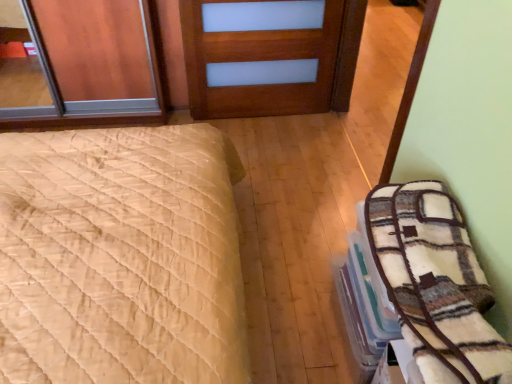
The image size is (512, 384). Describe the element at coordinates (260, 56) in the screenshot. I see `wooden door at center` at that location.

Describe the element at coordinates (435, 283) in the screenshot. Image resolution: width=512 pixels, height=384 pixels. I see `plush white blanket at right` at that location.

Locate an element on the screen. beige quilted bed at left is located at coordinates (121, 257).

From a real-world perspective, is plush white blanket at right physically located above or below beige quilted bed at left?

Clearly, from a real-world perspective, plush white blanket at right is above beige quilted bed at left.

Which of these two, plush white blanket at right or beige quilted bed at left, is bigger?

With larger size is beige quilted bed at left.

What's the angular difference between plush white blanket at right and beige quilted bed at left's facing directions?

The angular difference between plush white blanket at right and beige quilted bed at left is 180 degrees.

Consider the image. From the image's perspective, is plush white blanket at right beneath beige quilted bed at left?

Correct, plush white blanket at right appears lower than beige quilted bed at left in the image.

Is beige quilted bed at left bigger than wooden door at center?

Yes.

Which is more to the left, beige quilted bed at left or wooden door at center?

From the viewer's perspective, beige quilted bed at left appears more on the left side.

How much distance is there between beige quilted bed at left and wooden door at center?

beige quilted bed at left and wooden door at center are 3.84 feet apart.

Can you confirm if beige quilted bed at left is thinner than wooden door at center?

No.

Is plush white blanket at right facing away from wooden door at center?

No, plush white blanket at right is not facing the opposite direction of wooden door at center.

Looking at this image, from the image's perspective, is plush white blanket at right located beneath wooden door at center?

Correct, plush white blanket at right appears lower than wooden door at center in the image.

Is plush white blanket at right bigger or smaller than wooden door at center?

Clearly, plush white blanket at right is smaller in size than wooden door at center.

Considering the positions of objects plush white blanket at right and wooden door at center in the image provided, who is more to the right, plush white blanket at right or wooden door at center?

plush white blanket at right is more to the right.

Considering the sizes of objects wooden door at center and plush white blanket at right in the image provided, who is bigger, wooden door at center or plush white blanket at right?

Bigger between the two is wooden door at center.

Is wooden door at center wider or thinner than plush white blanket at right?

In the image, wooden door at center appears to be more narrow than plush white blanket at right.

Would you say wooden door at center is inside or outside plush white blanket at right?

The correct answer is: outside.

Is beige quilted bed at left spatially inside plush white blanket at right, or outside of it?

beige quilted bed at left is not inside plush white blanket at right, it's outside.

Considering the relative positions of beige quilted bed at left and plush white blanket at right in the image provided, is beige quilted bed at left to the right of plush white blanket at right from the viewer's perspective?

Incorrect, beige quilted bed at left is not on the right side of plush white blanket at right.

Considering the sizes of objects beige quilted bed at left and plush white blanket at right in the image provided, who is shorter, beige quilted bed at left or plush white blanket at right?

Standing shorter between the two is plush white blanket at right.

Is point (51, 356) in front of point (436, 193)?

Yes, it is in front of point (436, 193).

Is wooden door at center situated inside beige quilted bed at left or outside?

wooden door at center is not enclosed by beige quilted bed at left.

Which object is further away from the camera taking this photo, wooden door at center or beige quilted bed at left?

Positioned behind is wooden door at center.

Is wooden door at center oriented towards beige quilted bed at left?

No, wooden door at center is not oriented towards beige quilted bed at left.

How many degrees apart are the facing directions of wooden door at center and beige quilted bed at left?

71.2 degrees separate the facing orientations of wooden door at center and beige quilted bed at left.

Image resolution: width=512 pixels, height=384 pixels. I want to click on bedding below the beige quilted bed at left (from the image's perspective), so click(435, 283).

The height and width of the screenshot is (384, 512). Find the location of `door located behind the beige quilted bed at left`. door located behind the beige quilted bed at left is located at coordinates tap(260, 56).

Consider the image. When comparing their distances from wooden door at center, does plush white blanket at right or beige quilted bed at left seem further?

plush white blanket at right lies further to wooden door at center than the other object.

Estimate the real-world distances between objects in this image. Which object is closer to plush white blanket at right, beige quilted bed at left or wooden door at center?

beige quilted bed at left is positioned closer to the anchor plush white blanket at right.

From the picture: Considering their positions, is wooden door at center positioned closer to beige quilted bed at left than plush white blanket at right?

plush white blanket at right is positioned closer to the anchor beige quilted bed at left.

Considering their positions, is plush white blanket at right positioned closer to beige quilted bed at left than wooden door at center?

plush white blanket at right.

Based on their spatial positions, is beige quilted bed at left or plush white blanket at right closer to wooden door at center?

beige quilted bed at left lies closer to wooden door at center than the other object.

Which object lies further to the anchor point plush white blanket at right, wooden door at center or beige quilted bed at left?

wooden door at center is further to plush white blanket at right.

Find the location of `bedding positioned between beige quilted bed at left and wooden door at center from near to far`. bedding positioned between beige quilted bed at left and wooden door at center from near to far is located at coordinates (435, 283).